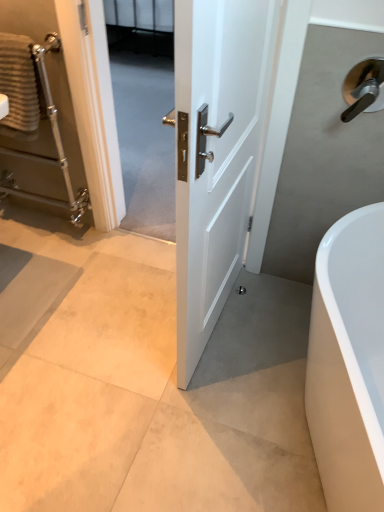
What do you see at coordinates (215, 153) in the screenshot?
I see `white glossy door at center` at bounding box center [215, 153].

In order to face white glossy bathtub at lower right, should I rotate leftwards or rightwards?

It's best to rotate right around 24.587 degrees.

This screenshot has height=512, width=384. Identify the location of white glossy bathtub at lower right. (349, 362).

In order to face polished silver door handle at upper right, should I rotate leftwards or rightwards?

Rotate right and turn 23.062 degrees.

What is the approximate width of polished silver door handle at upper right?

3.19 inches.

Locate an element on the screen. white glossy door at center is located at coordinates (215, 153).

Which is in front, polished chrome towel rack at left or polished silver door handle at upper right?

polished silver door handle at upper right is in front.

Does polished chrome towel rack at left have a lesser height compared to polished silver door handle at upper right?

No.

Where is `elevator that is under the polished silver door handle at upper right (from a real-world perspective)`? elevator that is under the polished silver door handle at upper right (from a real-world perspective) is located at coordinates (37, 112).

Considering the points (38, 115) and (374, 64), which point is behind, point (38, 115) or point (374, 64)?

Positioned behind is point (38, 115).

How many degrees apart are the facing directions of textured beige towel at left and white glossy door at center?

94.7 degrees separate the facing orientations of textured beige towel at left and white glossy door at center.

Looking at this image, is textured beige towel at left in front of or behind white glossy door at center in the image?

textured beige towel at left is behind white glossy door at center.

Is point (22, 80) closer or farther from the camera than point (192, 248)?

Point (22, 80) appears to be farther away from the viewer than point (192, 248).

How much distance is there between white glossy bathtub at lower right and polished chrome towel rack at left?

4.45 feet.

From the picture: Considering the relative sizes of white glossy bathtub at lower right and polished chrome towel rack at left in the image provided, is white glossy bathtub at lower right wider than polished chrome towel rack at left?

Yes.

Is polished chrome towel rack at left completely or partially inside white glossy bathtub at lower right?

No.

From a real-world perspective, is white glossy bathtub at lower right on top of white glossy door at center?

Actually, white glossy bathtub at lower right is physically below white glossy door at center in the real world.

Based on the photo, based on their sizes in the image, would you say white glossy bathtub at lower right is bigger or smaller than white glossy door at center?

Clearly, white glossy bathtub at lower right is larger in size than white glossy door at center.

Considering the relative sizes of white glossy bathtub at lower right and white glossy door at center in the image provided, is white glossy bathtub at lower right taller than white glossy door at center?

No.

Visually, is white glossy door at center positioned to the left or to the right of polished chrome towel rack at left?

From the image, it's evident that white glossy door at center is to the right of polished chrome towel rack at left.

From the picture: From the image's perspective, is white glossy door at center positioned above or below polished chrome towel rack at left?

Clearly, from the image's perspective, white glossy door at center is below polished chrome towel rack at left.

Locate an element on the screen. The width and height of the screenshot is (384, 512). elevator that appears below the white glossy door at center (from a real-world perspective) is located at coordinates (37, 112).

Considering the sizes of objects white glossy door at center and polished chrome towel rack at left in the image provided, who is thinner, white glossy door at center or polished chrome towel rack at left?

white glossy door at center is thinner.

How different are the orientations of polished silver door handle at upper right and white glossy bathtub at lower right in degrees?

polished silver door handle at upper right and white glossy bathtub at lower right are facing 66.2 degrees away from each other.

From the image's perspective, which one is positioned higher, polished silver door handle at upper right or white glossy bathtub at lower right?

polished silver door handle at upper right, from the image's perspective.

At what (x,y) coordinates should I click in order to perform the action: click on door handle on the left of white glossy bathtub at lower right. Please return your answer as a coordinate pair (x, y). Image resolution: width=384 pixels, height=512 pixels. Looking at the image, I should click on (363, 88).

Is polished silver door handle at upper right far away from white glossy bathtub at lower right?

No.

Is polished chrome towel rack at left turned away from white glossy bathtub at lower right?

A: No, polished chrome towel rack at left's orientation is not away from white glossy bathtub at lower right.

Find the location of a particular element. bathtub below the polished chrome towel rack at left (from the image's perspective) is located at coordinates (349, 362).

From the image's perspective, does polished chrome towel rack at left appear higher than white glossy bathtub at lower right?

Indeed, from the image's perspective, polished chrome towel rack at left is shown above white glossy bathtub at lower right.

Which object is more forward, polished chrome towel rack at left or white glossy bathtub at lower right?

white glossy bathtub at lower right.

The height and width of the screenshot is (512, 384). Find the location of `elevator that is behind the polished silver door handle at upper right`. elevator that is behind the polished silver door handle at upper right is located at coordinates (37, 112).

Identify the location of door below the textured beige towel at left (from the image's perspective). The width and height of the screenshot is (384, 512). pyautogui.click(x=215, y=153).

Which object lies nearer to the anchor point polished chrome towel rack at left, polished silver door handle at upper right or white glossy door at center?

Among the two, white glossy door at center is located nearer to polished chrome towel rack at left.

Considering their positions, is white glossy door at center positioned further to textured beige towel at left than white glossy bathtub at lower right?

Based on the image, white glossy bathtub at lower right appears to be further to textured beige towel at left.

Based on the photo, from the image, which object appears to be nearer to white glossy door at center, polished silver door handle at upper right or white glossy bathtub at lower right?

Based on the image, white glossy bathtub at lower right appears to be nearer to white glossy door at center.

When comparing their distances from white glossy door at center, does white glossy bathtub at lower right or textured beige towel at left seem further?

textured beige towel at left is further to white glossy door at center.

When comparing their distances from polished silver door handle at upper right, does textured beige towel at left or white glossy bathtub at lower right seem closer?

Among the two, white glossy bathtub at lower right is located nearer to polished silver door handle at upper right.

Estimate the real-world distances between objects in this image. Which object is further from textured beige towel at left, polished chrome towel rack at left or white glossy door at center?

The object further to textured beige towel at left is white glossy door at center.

Estimate the real-world distances between objects in this image. Which object is closer to white glossy bathtub at lower right, polished silver door handle at upper right or textured beige towel at left?

polished silver door handle at upper right is closer to white glossy bathtub at lower right.

When comparing their distances from polished chrome towel rack at left, does white glossy door at center or white glossy bathtub at lower right seem closer?

Among the two, white glossy door at center is located nearer to polished chrome towel rack at left.

Where is `door handle between polished chrome towel rack at left and white glossy bathtub at lower right`? The height and width of the screenshot is (512, 384). door handle between polished chrome towel rack at left and white glossy bathtub at lower right is located at coordinates (363, 88).

You are a GUI agent. You are given a task and a screenshot of the screen. Output one action in this format:
    pyautogui.click(x=<x>, y=<y>)
    Task: Click on the material between polished chrome towel rack at left and white glossy door at center from left to right
    
    Given the screenshot: What is the action you would take?
    pyautogui.click(x=19, y=82)

Identify the location of material located between polished chrome towel rack at left and polished silver door handle at upper right in the left-right direction. This screenshot has width=384, height=512. (19, 82).

You are a GUI agent. You are given a task and a screenshot of the screen. Output one action in this format:
    pyautogui.click(x=<x>, y=<y>)
    Task: Click on the door handle between textured beige towel at left and white glossy bathtub at lower right from left to right
    
    Given the screenshot: What is the action you would take?
    pyautogui.click(x=363, y=88)